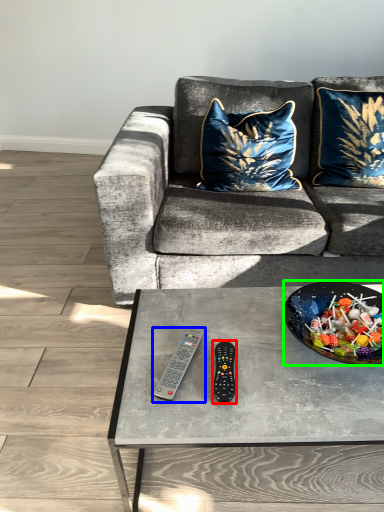
Question: Which is nearer to the remote (highlighted by a red box)? remote control (highlighted by a blue box) or bowl (highlighted by a green box).

Choices:
 (A) remote control
 (B) bowl

Answer: (A)